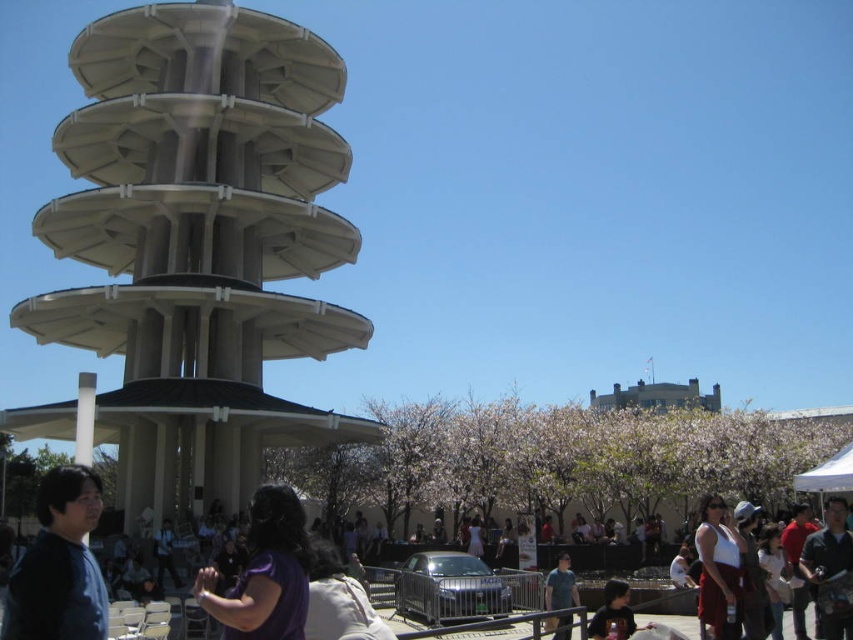
You are standing at point (549, 580) and want to walk towards the pagoda in the foreground. Is point (154, 349) located behind you or in front of you relative to your direction of movement?

Point (154, 349) is behind point (549, 580), so if you are facing the pagoda in the foreground, point (154, 349) would be behind you relative to your direction of movement.

You are at the outdoor event and want to know if you can fit a small cooler between the dark brown shirt at lower center and the white fabric canopy at lower right. Can you determine if there is enough space?

The dark brown shirt at lower center occupies less space than the white fabric canopy at lower right, so there is likely enough space to fit a small cooler between them.

Based on the photo, you are standing at the base of the pagoda structure and want to throw a paper airplane to reach both the purple matte shirt at center and the blue denim shirt at center. Given that the maximum distance you can throw is 80 feet, will your throw reach both shirts?

The purple matte shirt at center is 86.06 feet away from the blue denim shirt at center. Since your maximum throw distance is 80 feet, you cannot reach both shirts simultaneously as the distance between them exceeds your throwing range. You can only reach one of them depending on their individual distances from you.